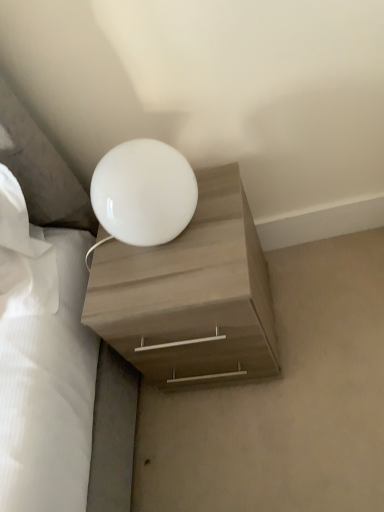
Question: Does matte wood nightstand at center have a greater width compared to white glossy lamp at upper center?

Choices:
 (A) no
 (B) yes

Answer: (A)

Question: Is matte wood nightstand at center next to white glossy lamp at upper center?

Choices:
 (A) yes
 (B) no

Answer: (B)

Question: Is matte wood nightstand at center closer to camera compared to white glossy lamp at upper center?

Choices:
 (A) yes
 (B) no

Answer: (A)

Question: Considering the relative sizes of matte wood nightstand at center and white glossy lamp at upper center in the image provided, is matte wood nightstand at center bigger than white glossy lamp at upper center?

Choices:
 (A) yes
 (B) no

Answer: (A)

Question: From the image's perspective, does matte wood nightstand at center appear higher than white glossy lamp at upper center?

Choices:
 (A) no
 (B) yes

Answer: (B)

Question: Does matte wood nightstand at center have a lesser height compared to white glossy lamp at upper center?

Choices:
 (A) no
 (B) yes

Answer: (A)

Question: Is matte wood nightstand at center looking in the opposite direction of white glossy sphere at upper center?

Choices:
 (A) yes
 (B) no

Answer: (B)

Question: Can you confirm if matte wood nightstand at center is thinner than white glossy sphere at upper center?

Choices:
 (A) yes
 (B) no

Answer: (B)

Question: From a real-world perspective, is matte wood nightstand at center located beneath white glossy sphere at upper center?

Choices:
 (A) yes
 (B) no

Answer: (A)

Question: Does matte wood nightstand at center lie behind white glossy sphere at upper center?

Choices:
 (A) no
 (B) yes

Answer: (B)

Question: From the image's perspective, is matte wood nightstand at center located beneath white glossy sphere at upper center?

Choices:
 (A) no
 (B) yes

Answer: (B)

Question: Is matte wood nightstand at center aimed at white glossy sphere at upper center?

Choices:
 (A) yes
 (B) no

Answer: (B)

Question: Is white glossy sphere at upper center next to white glossy lamp at upper center and touching it?

Choices:
 (A) no
 (B) yes

Answer: (A)